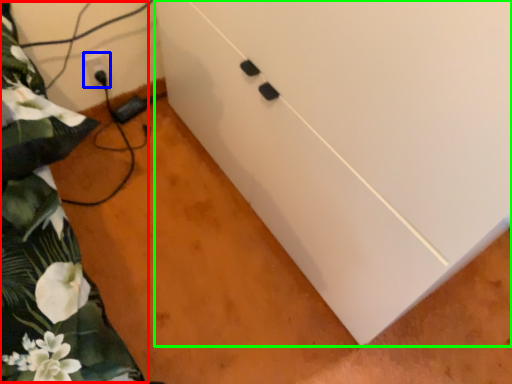
Question: Based on their relative distances, which object is nearer to bed (highlighted by a red box)? Choose from electric outlet (highlighted by a blue box) and cabinetry (highlighted by a green box).

Choices:
 (A) electric outlet
 (B) cabinetry

Answer: (B)